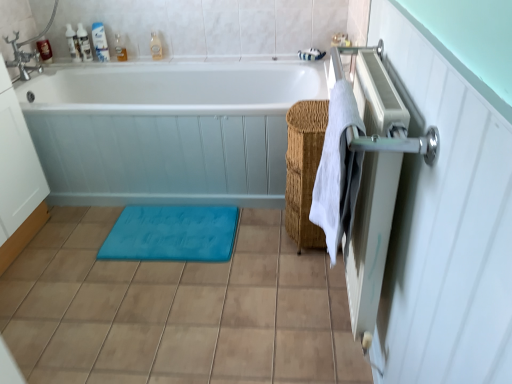
Question: Considering the relative positions of white glossy bathtub at center and white glossy bottle at upper left, acting as the third toiletry starting from the right, in the image provided, is white glossy bathtub at center to the left or to the right of white glossy bottle at upper left, acting as the third toiletry starting from the right,?

Choices:
 (A) left
 (B) right

Answer: (B)

Question: Is white glossy bathtub at center situated inside white glossy bottle at upper left, the fourth toiletry viewed from the left, or outside?

Choices:
 (A) outside
 (B) inside

Answer: (A)

Question: Based on their relative distances, which object is farther from the white cotton towel at right?

Choices:
 (A) translucent plastic bottle at upper left, acting as the fifth toiletry starting from the left
 (B) metallic silver radiator at right
 (C) translucent plastic bottles at upper left, arranged as the 5th toiletry when viewed from the right
 (D) woven brown basket at center-right
 (E) brown matte tile at lower center

Answer: (C)

Question: Which object is positioned closest to the translucent plastic bottles at upper left, arranged as the 5th toiletry when viewed from the right?

Choices:
 (A) white glossy bottle at upper left, positioned as the 4th toiletry in right-to-left order
 (B) white glossy bathtub at center
 (C) metallic silver radiator at right
 (D) translucent plastic soap at upper left, arranged as the 6th toiletry when viewed from the right
 (E) translucent plastic bottle at upper left, acting as the fifth toiletry starting from the left

Answer: (A)